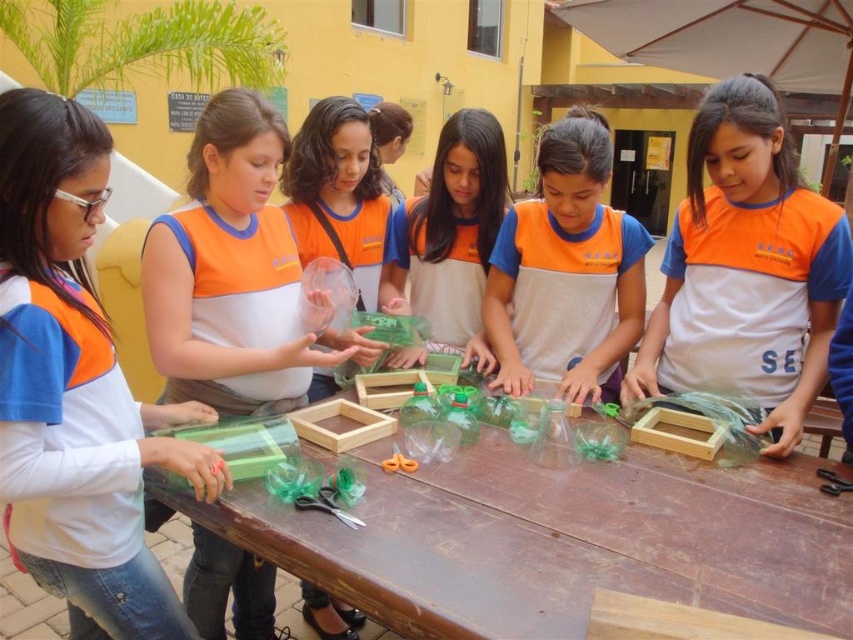
You are a participant in this activity and need to retrieve the orange plastic scissors at center. However, there is a matte orange vest at center blocking your access. Can you reach the scissors without moving the vest?

The matte orange vest at center is positioned over orange plastic scissors at center, so you cannot reach the scissors without moving the vest.